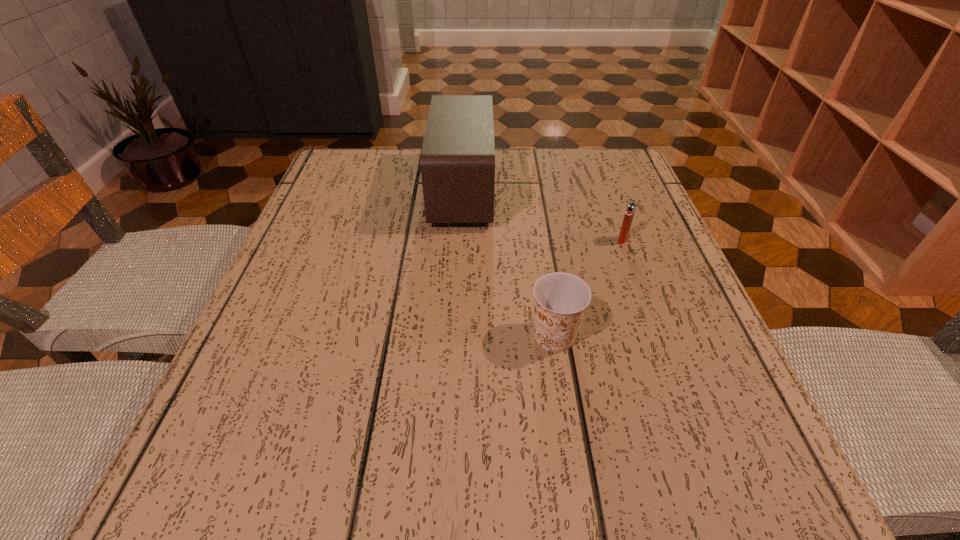
Locate an element on the screen. radio receiver is located at coordinates (457, 161).

What are the coordinates of `the farthest object` in the screenshot? It's located at (457, 161).

This screenshot has height=540, width=960. What are the coordinates of `Dixie cup` in the screenshot? It's located at (560, 299).

Find the location of a particular element. the second object from right to left is located at coordinates (560, 299).

Find the location of a particular element. The image size is (960, 540). igniter is located at coordinates (631, 207).

Where is `the rightmost object`? This screenshot has height=540, width=960. the rightmost object is located at coordinates (631, 207).

Where is `free space located 0.170m on the front-facing side of the tallest object`? free space located 0.170m on the front-facing side of the tallest object is located at coordinates (565, 191).

You are a GUI agent. You are given a task and a screenshot of the screen. Output one action in this format:
    pyautogui.click(x=<x>, y=<y>)
    Task: Click on the vacant area located on the back of the Dixie cup
    The image size is (960, 540).
    Given the screenshot: What is the action you would take?
    pyautogui.click(x=534, y=198)

Where is `free spot located 0.250m on the left of the shortest object`? free spot located 0.250m on the left of the shortest object is located at coordinates (492, 240).

What are the coordinates of `object present at the far edge` in the screenshot? It's located at (457, 161).